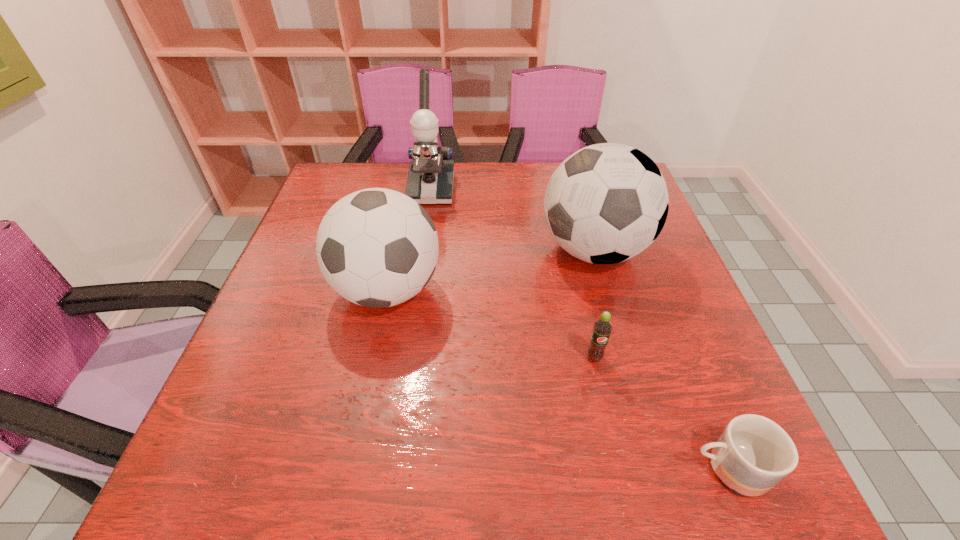
The height and width of the screenshot is (540, 960). In order to click on free spot between the fourth tallest object and the left soccer ball in this screenshot , I will do `click(491, 323)`.

Find the location of a particular element. free space between the left soccer ball and the right soccer ball is located at coordinates (491, 270).

Identify the location of free point between the microscope and the right soccer ball. Image resolution: width=960 pixels, height=540 pixels. (513, 220).

The width and height of the screenshot is (960, 540). In order to click on vacant area between the right soccer ball and the soda in this screenshot , I will do `click(594, 303)`.

Find the location of a particular element. free spot between the right soccer ball and the second shortest object is located at coordinates (594, 303).

You are a GUI agent. You are given a task and a screenshot of the screen. Output one action in this format:
    pyautogui.click(x=<x>, y=<y>)
    Task: Click on the free space between the left soccer ball and the soda
    The image size is (960, 540).
    Given the screenshot: What is the action you would take?
    pyautogui.click(x=491, y=323)

You are a GUI agent. You are given a task and a screenshot of the screen. Output one action in this format:
    pyautogui.click(x=<x>, y=<y>)
    Task: Click on the vacant area that lies between the left soccer ball and the shortest object
    The height and width of the screenshot is (540, 960).
    Given the screenshot: What is the action you would take?
    pyautogui.click(x=558, y=379)

This screenshot has width=960, height=540. I want to click on empty space that is in between the shortest object and the fourth farthest object, so click(660, 413).

Identify the location of the second closest object relative to the left soccer ball. The height and width of the screenshot is (540, 960). (606, 203).

Where is `object that is the nearest to the microscope`? The image size is (960, 540). object that is the nearest to the microscope is located at coordinates (376, 247).